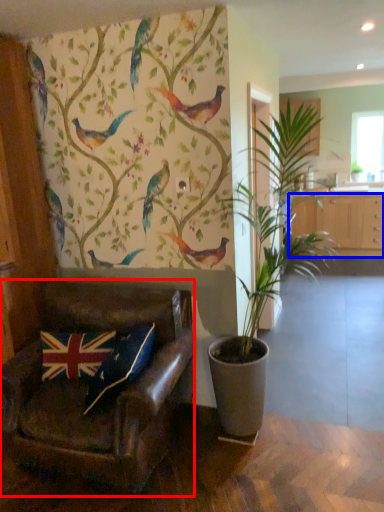
Question: Which point is closer to the camera, chair (highlighted by a red box) or cabinetry (highlighted by a blue box)?

Choices:
 (A) chair
 (B) cabinetry

Answer: (A)